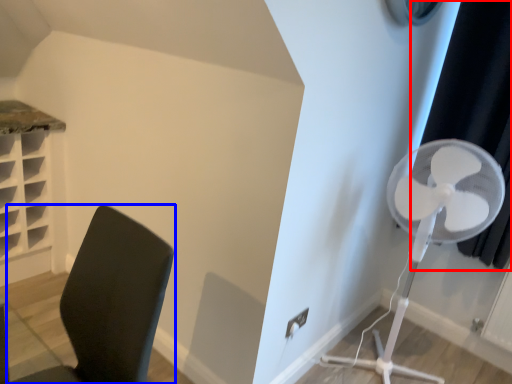
Question: Which object is further to the camera taking this photo, curtain (highlighted by a red box) or furniture (highlighted by a blue box)?

Choices:
 (A) curtain
 (B) furniture

Answer: (A)